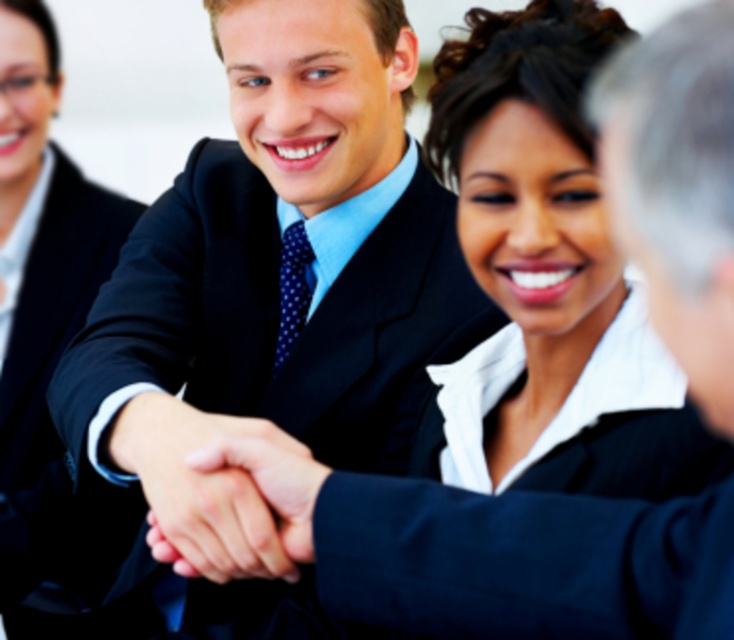
Question: Which object is closer to the camera taking this photo?

Choices:
 (A) black satin business suit at center
 (B) black smooth suit at center
 (C) smooth skin handshake at center

Answer: (C)

Question: Considering the relative positions of black satin business suit at center and black smooth suit at center in the image provided, where is black satin business suit at center located with respect to black smooth suit at center?

Choices:
 (A) left
 (B) right

Answer: (B)

Question: Is black satin business suit at center bigger than black smooth suit at center?

Choices:
 (A) no
 (B) yes

Answer: (A)

Question: Estimate the real-world distances between objects in this image. Which object is closer to the black smooth suit at center?

Choices:
 (A) black satin business suit at center
 (B) smooth skin handshake at center

Answer: (A)

Question: Can you confirm if black satin business suit at center is positioned to the left of black smooth suit at center?

Choices:
 (A) yes
 (B) no

Answer: (B)

Question: Which object is positioned closest to the black smooth suit at center?

Choices:
 (A) black satin business suit at center
 (B) smooth skin handshake at center

Answer: (A)